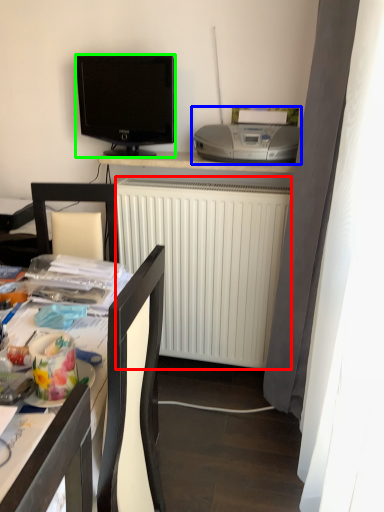
Question: Which is farther away from radiator (highlighted by a red box)? printer (highlighted by a blue box) or television (highlighted by a green box)?

Choices:
 (A) printer
 (B) television

Answer: (B)